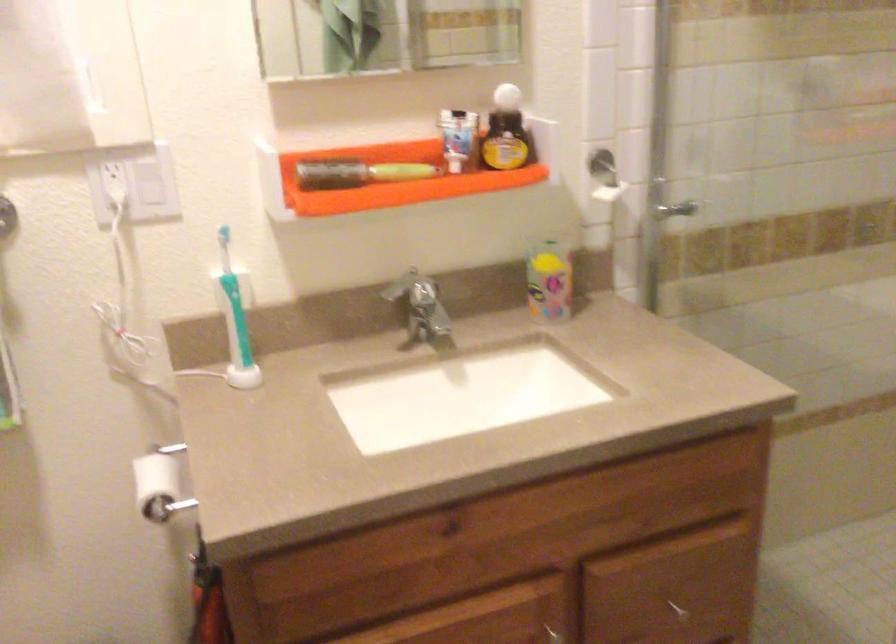
Find where to pull the white toilet paper roll. Please return your answer as a coordinate pair (x, y).

(159, 484)